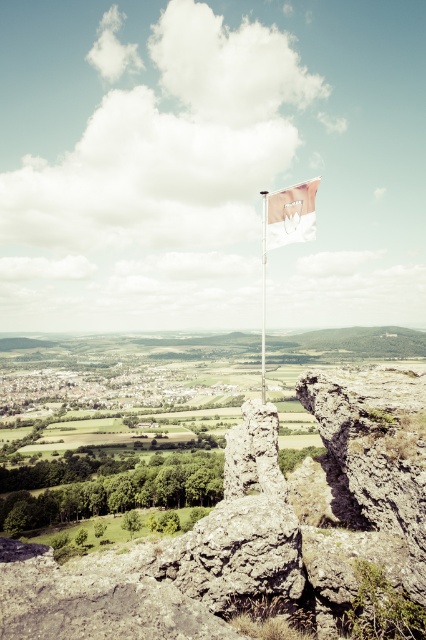
You are a hiker trying to locate the rugged stone cliff at center. According to the coordinates provided, where exactly is it positioned in the image?

The rugged stone cliff at center is located at point (253, 528), which means it is positioned towards the right and slightly above the center of the image.